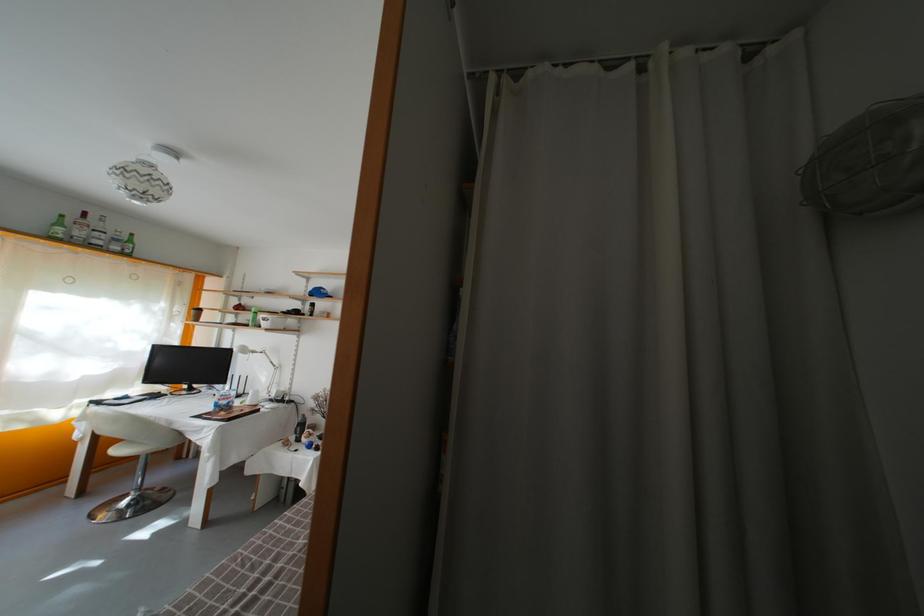
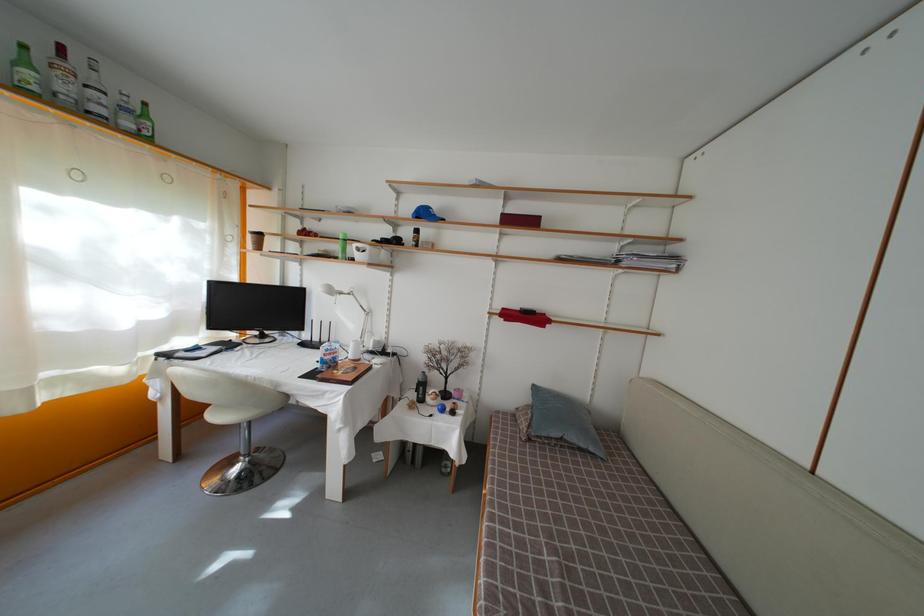
The point at (323, 299) is marked in the first image. Where is the corresponding point in the second image?

(430, 220)